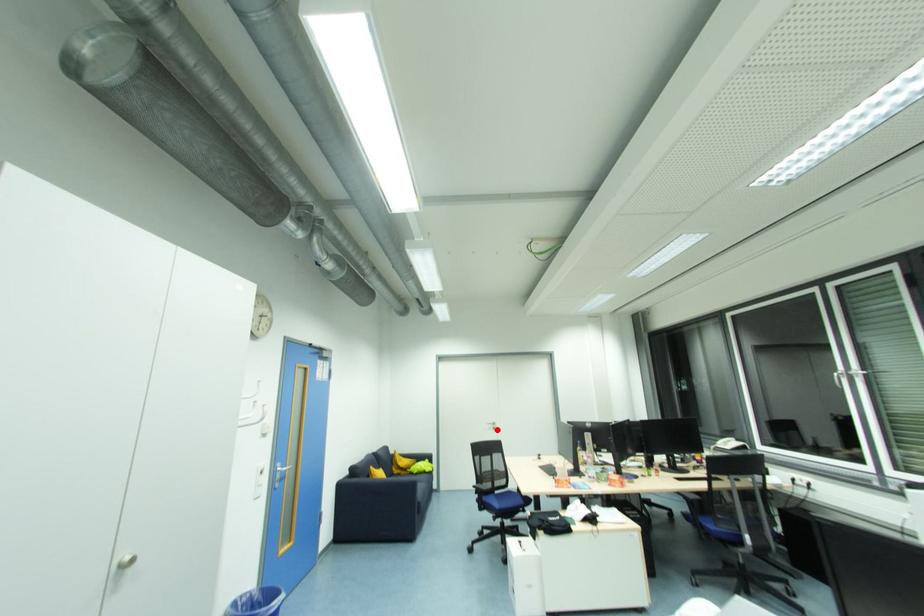
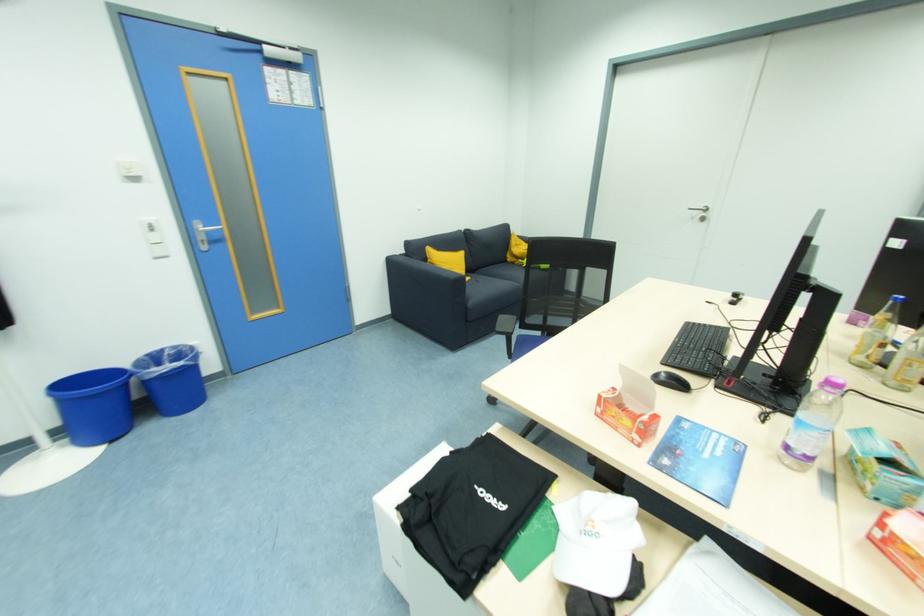
Where in the second image is the point corresponding to the highlighted location from the first image?

(706, 221)